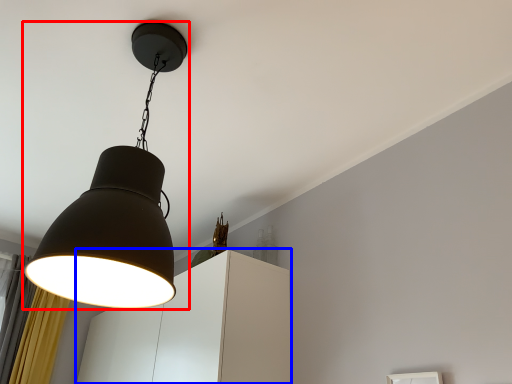
Question: Which point is closer to the camera, lamp (highlighted by a red box) or cabinetry (highlighted by a blue box)?

Choices:
 (A) lamp
 (B) cabinetry

Answer: (A)